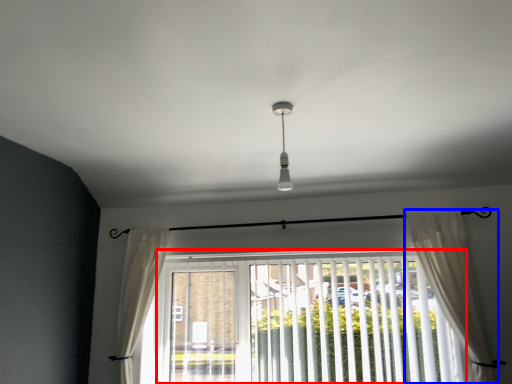
Question: Which of the following is the farthest to the observer, window blind (highlighted by a red box) or curtain (highlighted by a blue box)?

Choices:
 (A) window blind
 (B) curtain

Answer: (A)